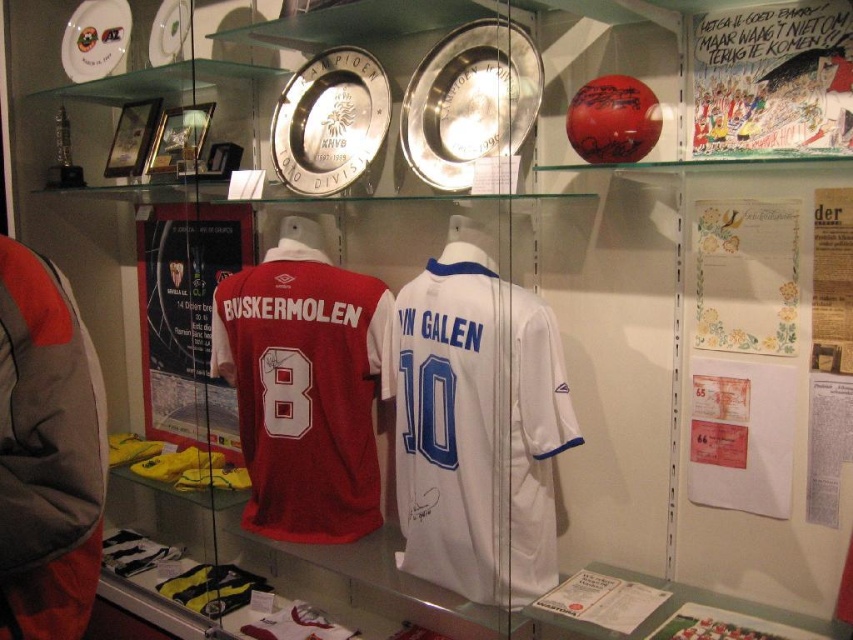
You are a museum visitor standing in front of the display case. You notice the brushed metal baseball uniform at left and the white fabric jersey at center. Which object is covering part of the other one?

The brushed metal baseball uniform at left is positioned over the white fabric jersey at center, so it is covering part of the white fabric jersey at center.

You are a museum visitor standing in front of the display case. You want to take a photo of both the brushed metal baseball uniform at left and the white fabric jersey at center. Since the display case is glass, you need to ensure that your reflection doesn not block either item. Considering their heights, which item will require you to crouch lower to avoid your reflection blocking it?

The brushed metal baseball uniform at left is taller than the white fabric jersey at center. To avoid blocking the taller item, you should crouch lower when photographing the brushed metal baseball uniform at left.